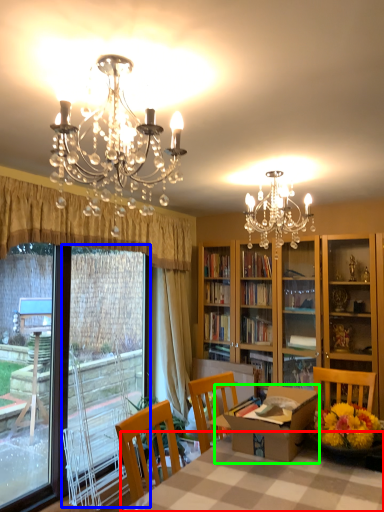
Question: Based on their relative distances, which object is nearer to table (highlighted by a red box)? Choose from screen door (highlighted by a blue box) and round table (highlighted by a green box).

Choices:
 (A) screen door
 (B) round table

Answer: (B)